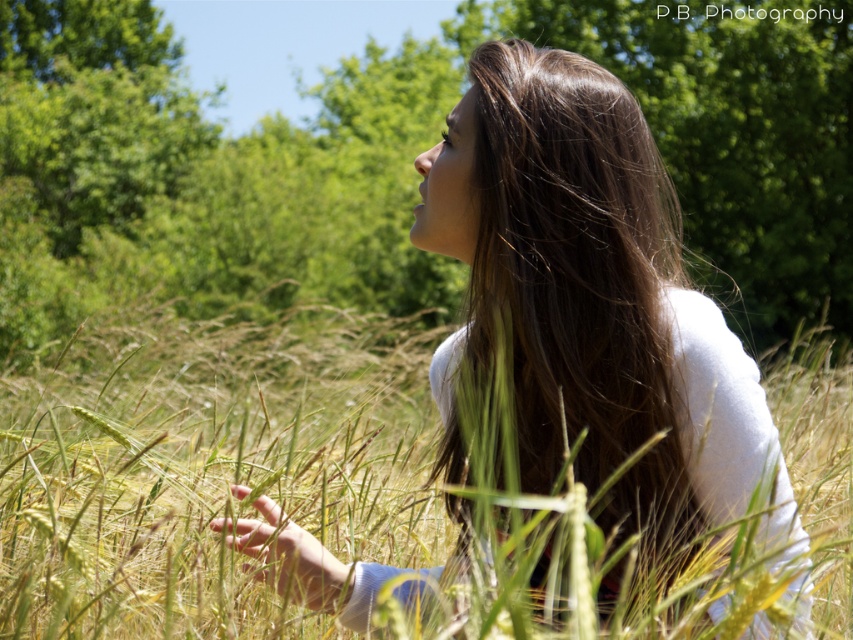
Question: Estimate the real-world distances between objects in this image. Which object is farther from the brown silky hair at center?

Choices:
 (A) yellow-green grass at center
 (B) white soft fabric at center

Answer: (A)

Question: Which is nearer to the brown silky hair at center?

Choices:
 (A) yellow-green grass at center
 (B) white soft fabric at center

Answer: (B)

Question: Can you confirm if yellow-green grass at center is positioned to the right of white soft fabric at center?

Choices:
 (A) yes
 (B) no

Answer: (A)

Question: Is yellow-green grass at center smaller than white soft fabric at center?

Choices:
 (A) yes
 (B) no

Answer: (B)

Question: Which object appears farthest from the camera in this image?

Choices:
 (A) white soft fabric at center
 (B) yellow-green grass at center
 (C) brown silky hair at center

Answer: (C)

Question: Is yellow-green grass at center to the left of brown silky hair at center from the viewer's perspective?

Choices:
 (A) yes
 (B) no

Answer: (B)